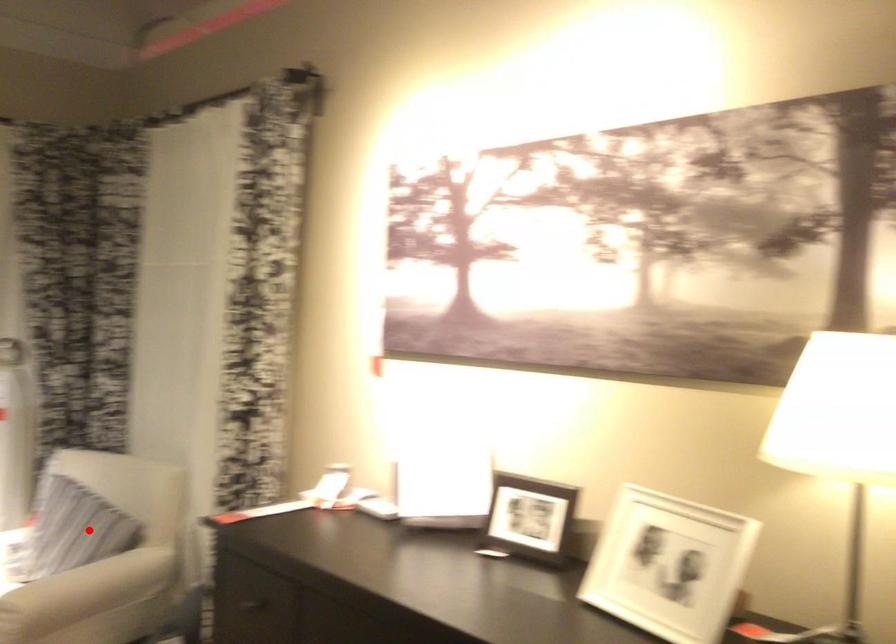
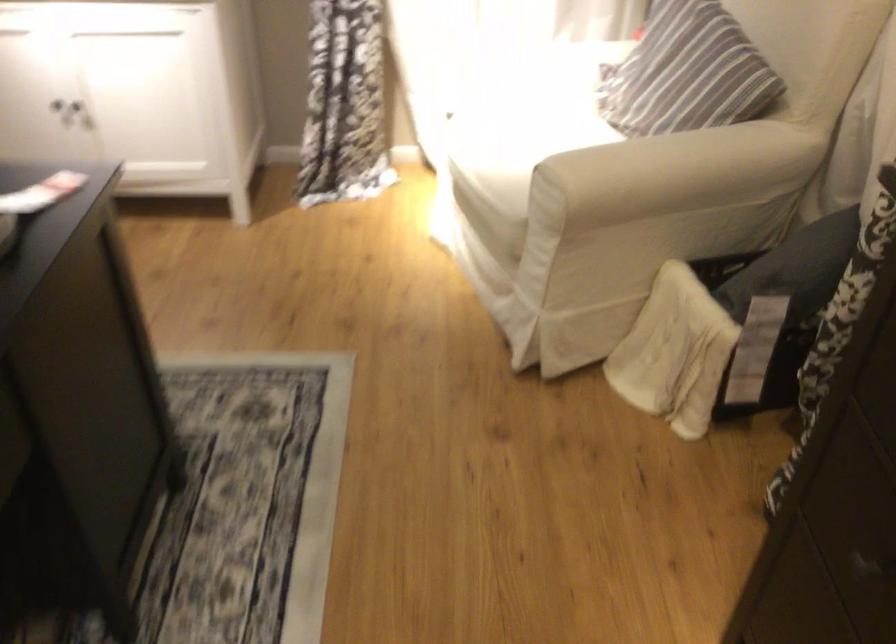
Where in the second image is the point corresponding to the highlighted location from the first image?

(687, 73)